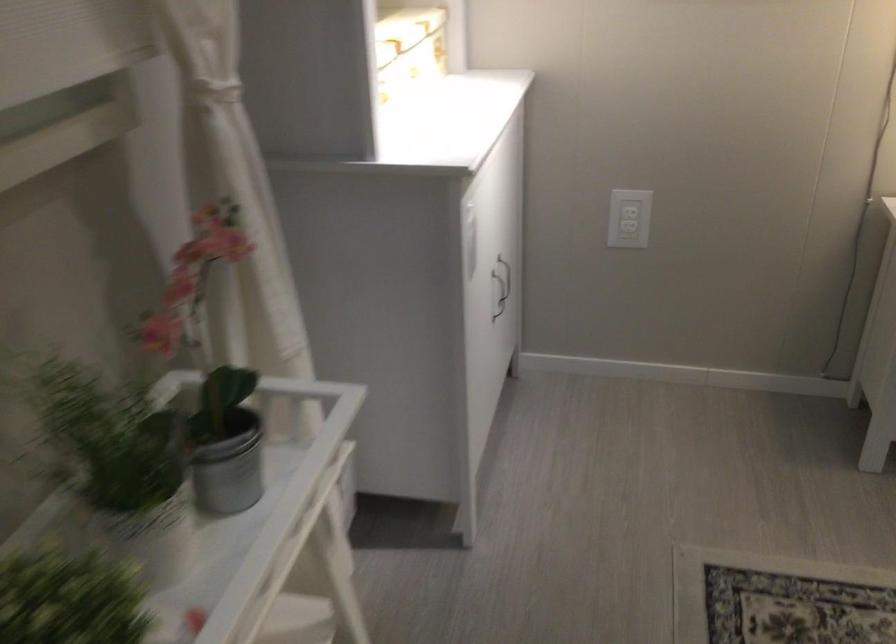
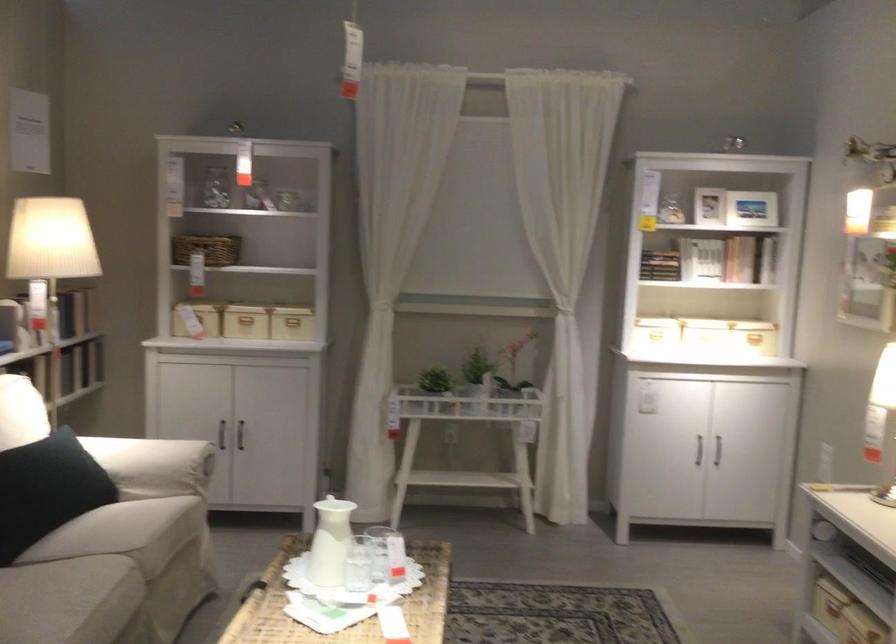
Locate, in the second image, the point that corresponds to point 478,89 in the first image.

(755, 339)